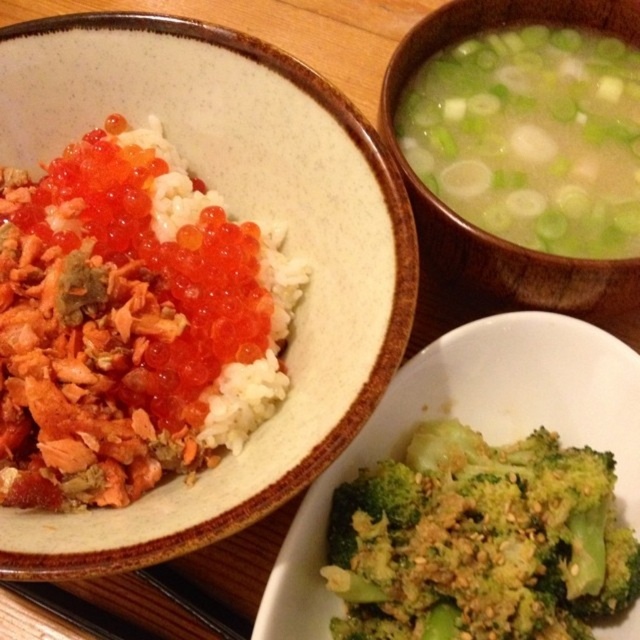
You are a food delivery person who needs to place a hot plate between the matte brown bowl at upper right and the matte ceramic bowl at upper left. The plate is 12 inches long. Can you fit it between them without moving the bowls?

The distance between the matte brown bowl at upper right and the matte ceramic bowl at upper left is 11.73 inches. Since the plate is 12 inches long, it cannot fit between them without moving the bowls.

You are at a restaurant table and want to reach for the green textured broccoli at lower right and the matte brown bowl at upper right. Which object is closer to your left hand?

The green textured broccoli at lower right is to the left of the matte brown bowl at upper right, so it is closer to your left hand.